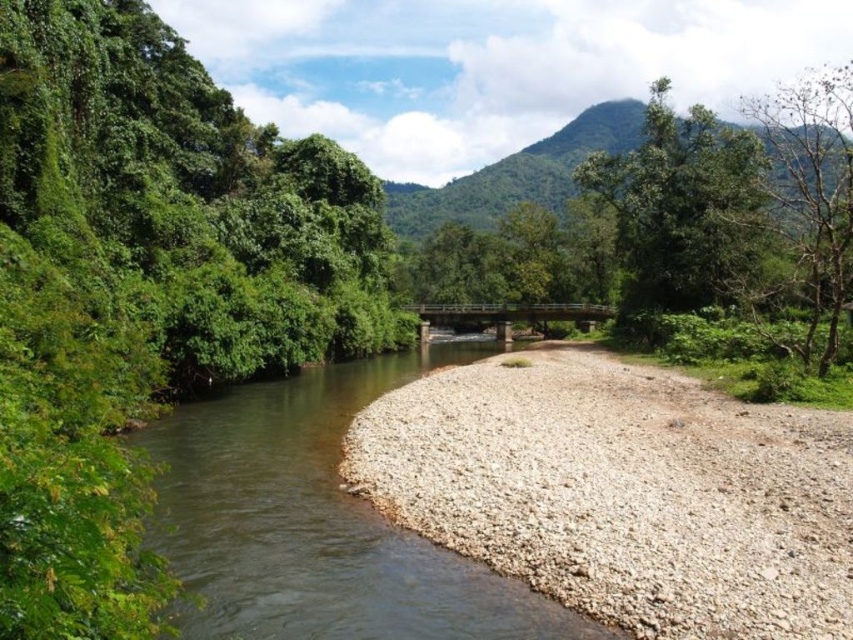
You are standing at the edge of the brown gravel river at center and want to walk to the green leafy tree at right. Which direction should you head to reach the tree?

To reach the green leafy tree at right from the brown gravel river at center, you should head towards the right side of the river since the tree is located at the right bank, which is further away from the viewer compared to the river.

You are standing on the small bridge spanning the river and want to locate the green leafy tree at left and the green leafy tree at right. Which tree is positioned farther to the east?

The green leafy tree at right is positioned farther to the east because it is to the right of the green leafy tree at left, and in the image, right corresponds to east.

You are a hiker who wants to take a photo of both the green leafy mountain at upper center and the green leafy tree at right in the same frame. Given that your camera has a maximum zoom range of 100 feet, will you be able to capture both in a single shot?

The green leafy mountain at upper center and green leafy tree at right are 277.90 feet apart from each other, which exceeds the camera maximum zoom range of 100 feet. Therefore, you will not be able to capture both in a single shot.